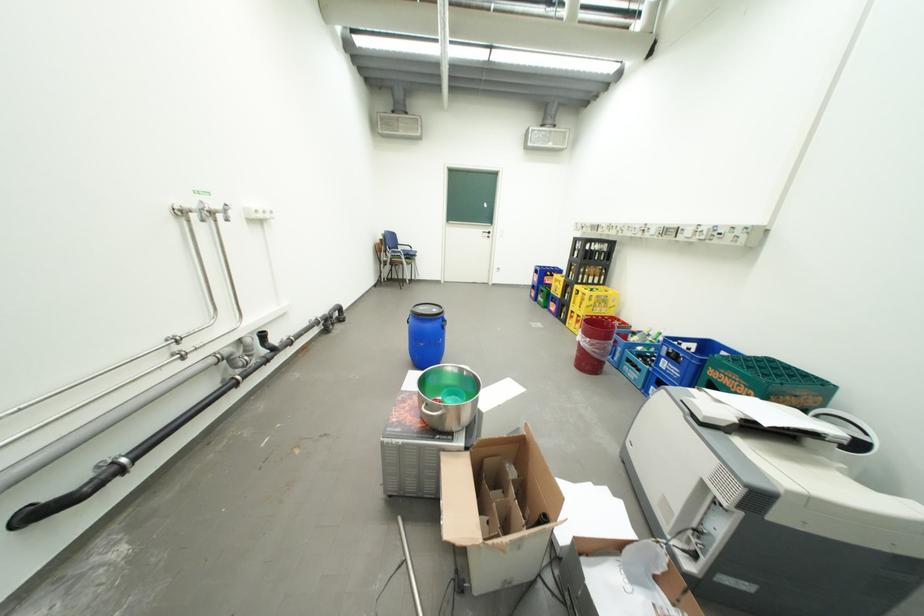
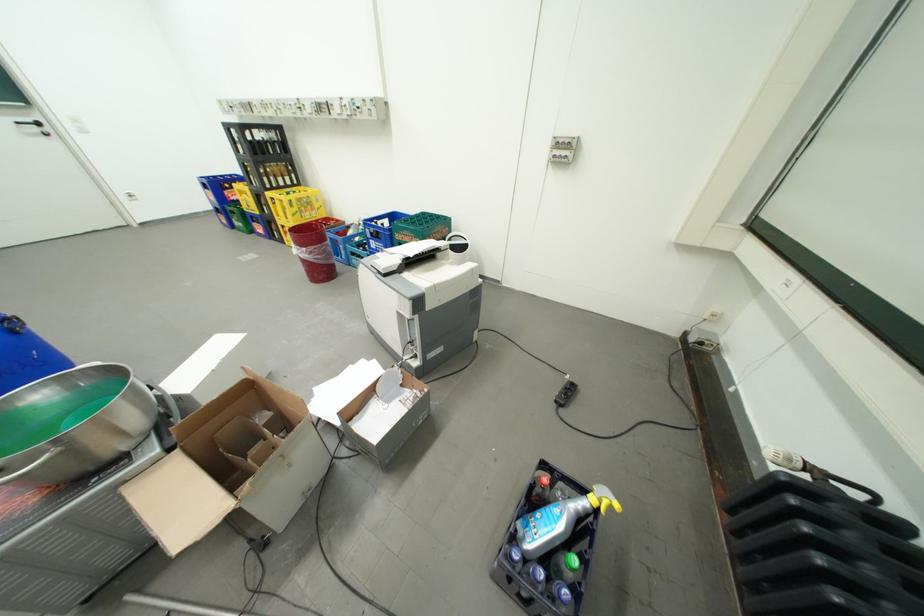
In the second image, find the point that corresponds to point (756, 387) in the first image.

(424, 238)